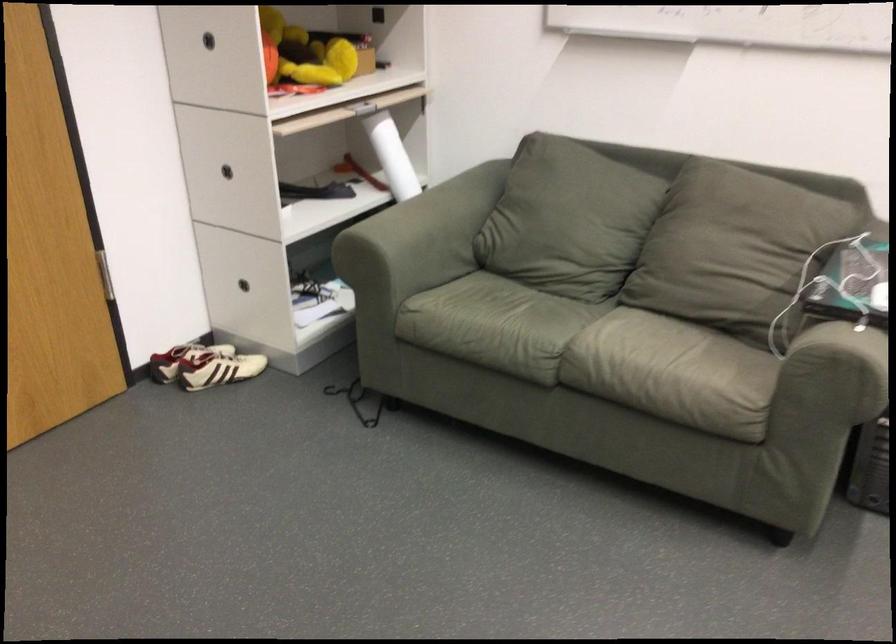
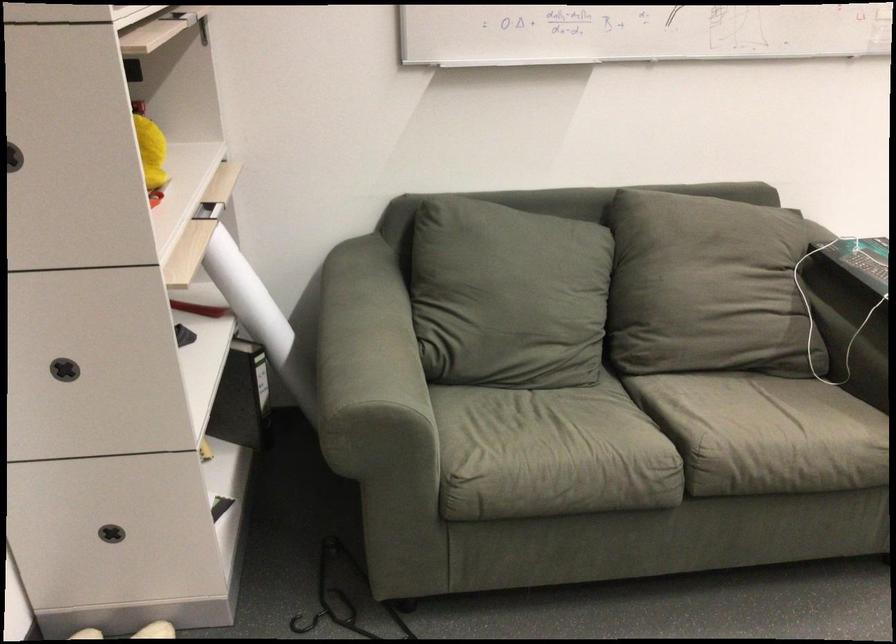
Where in the second image is the point corresponding to [554,339] from the first image?

(653, 444)